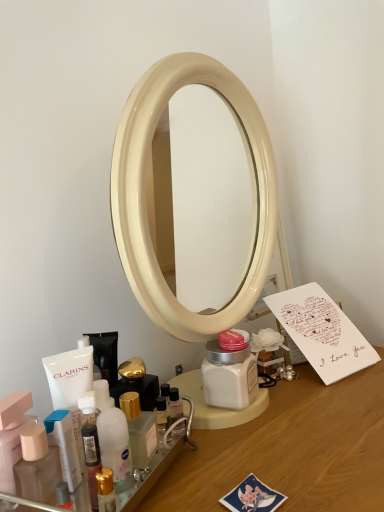
Where is `vacant space that is to the left of white paper card at right`? This screenshot has width=384, height=512. vacant space that is to the left of white paper card at right is located at coordinates (257, 416).